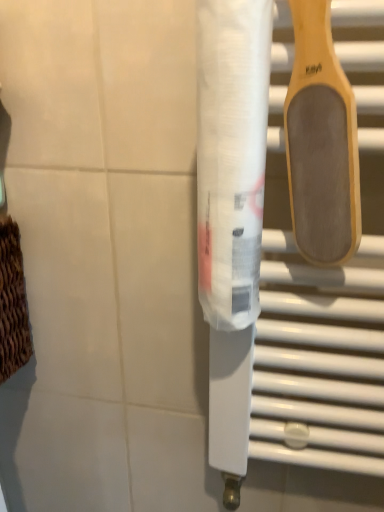
Question: Based on their sizes in the image, would you say transparent plastic toilet paper at center is bigger or smaller than wooden/textured spatula at upper right?

Choices:
 (A) big
 (B) small

Answer: (A)

Question: Is transparent plastic toilet paper at center taller or shorter than wooden/textured spatula at upper right?

Choices:
 (A) tall
 (B) short

Answer: (A)

Question: Visually, is transparent plastic toilet paper at center positioned to the left or to the right of wooden/textured spatula at upper right?

Choices:
 (A) left
 (B) right

Answer: (A)

Question: Is wooden/textured spatula at upper right taller or shorter than transparent plastic toilet paper at center?

Choices:
 (A) tall
 (B) short

Answer: (B)

Question: From the image's perspective, is wooden/textured spatula at upper right located above or below transparent plastic toilet paper at center?

Choices:
 (A) below
 (B) above

Answer: (B)

Question: Is point (332, 263) positioned closer to the camera than point (251, 257)?

Choices:
 (A) farther
 (B) closer

Answer: (A)

Question: From a real-world perspective, is wooden/textured spatula at upper right positioned above or below transparent plastic toilet paper at center?

Choices:
 (A) below
 (B) above

Answer: (B)